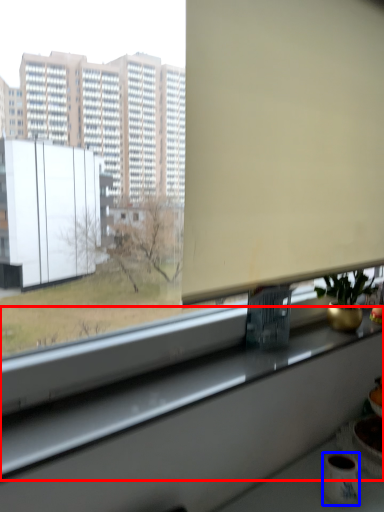
Question: Which object appears farthest to the camera in this image, window sill (highlighted by a red box) or mug (highlighted by a blue box)?

Choices:
 (A) window sill
 (B) mug

Answer: (B)